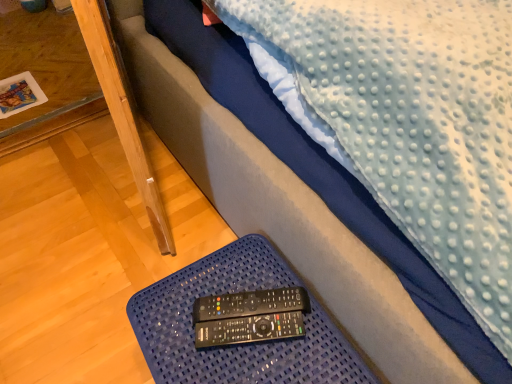
Find the location of a particular element. This screenshot has height=384, width=512. free point above blue textured tray at lower center (from a real-world perspective) is located at coordinates click(x=237, y=323).